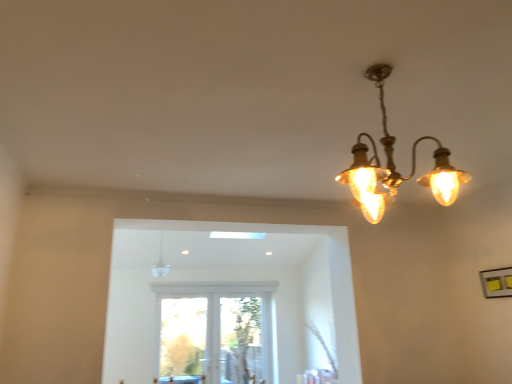
Question: From a real-world perspective, is clear glass pendant light at upper center, which is counted as the 2th lamp, starting from the top, physically located above or below matte brass chandelier at upper right, which ranks as the first lamp in front-to-back order?

Choices:
 (A) below
 (B) above

Answer: (B)

Question: In the image, is clear glass pendant light at upper center, the first lamp positioned from the left, positioned in front of or behind matte brass chandelier at upper right, placed as the 2th lamp when sorted from left to right?

Choices:
 (A) behind
 (B) front

Answer: (A)

Question: Choose the correct answer: Is clear glass pendant light at upper center, placed as the 2th lamp when sorted from front to back, inside matte brass chandelier at upper right, marked as the second lamp in a back-to-front arrangement, or outside it?

Choices:
 (A) inside
 (B) outside

Answer: (B)

Question: In terms of width, does matte brass chandelier at upper right, which is counted as the 2th lamp, starting from the bottom, look wider or thinner when compared to clear glass pendant light at upper center, the first lamp positioned from the left?

Choices:
 (A) thin
 (B) wide

Answer: (B)

Question: In the image, is matte brass chandelier at upper right, which is the 1th lamp from top to bottom, positioned in front of or behind clear glass pendant light at upper center, placed as the 2th lamp when sorted from front to back?

Choices:
 (A) front
 (B) behind

Answer: (A)

Question: In terms of height, does matte brass chandelier at upper right, positioned as the first lamp in right-to-left order, look taller or shorter compared to clear glass pendant light at upper center, which is counted as the 2th lamp, starting from the top?

Choices:
 (A) tall
 (B) short

Answer: (A)

Question: Is matte brass chandelier at upper right, positioned as the first lamp in right-to-left order, spatially inside clear glass pendant light at upper center, the 2th lamp viewed from the right, or outside of it?

Choices:
 (A) outside
 (B) inside

Answer: (A)